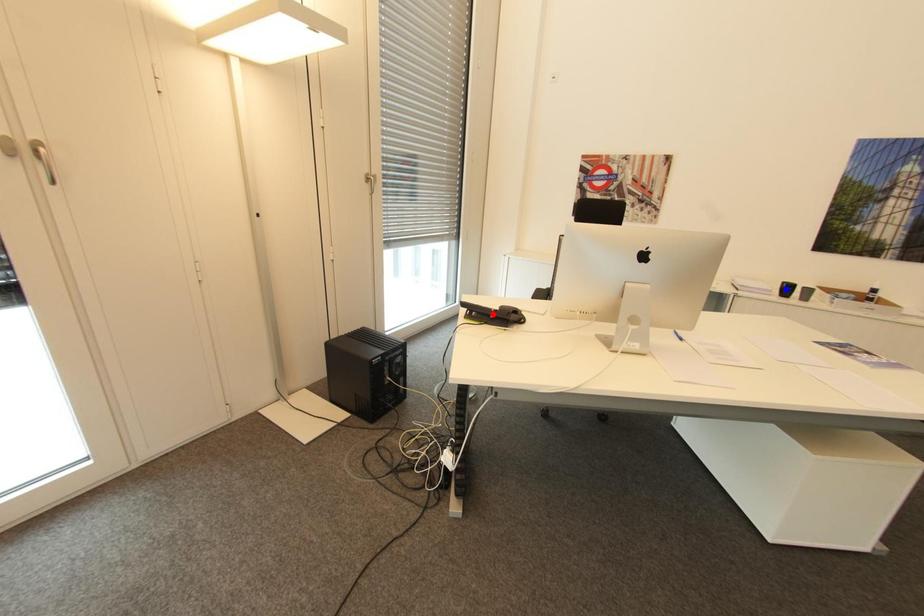
Question: Which of the two points in the image is closer to the camera?

Choices:
 (A) Blue point is closer.
 (B) Red point is closer.

Answer: (B)